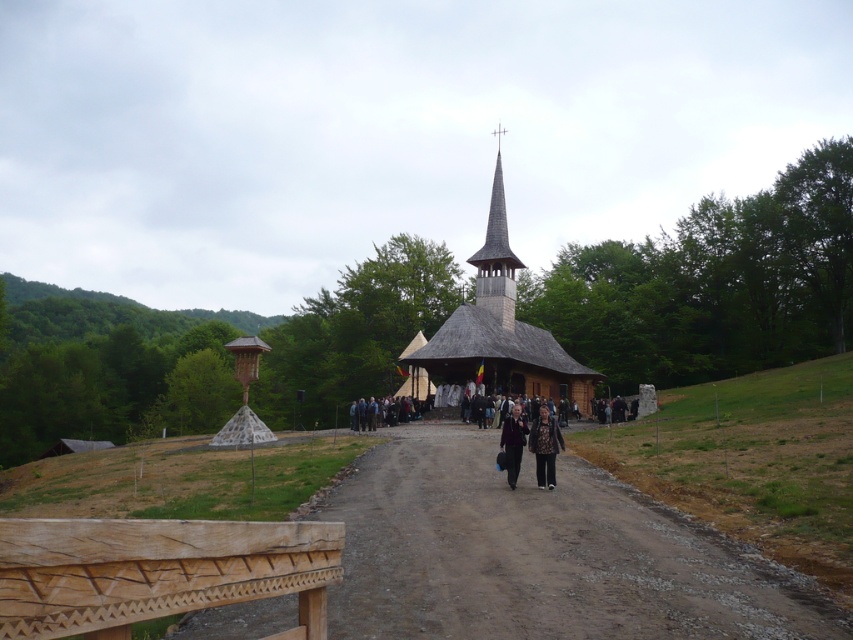
You are standing at the entrance of the church and see the wooden gazebo at left and the dark brown leather jacket at center. Which object is closer to your right side?

The dark brown leather jacket at center is closer to your right side because the wooden gazebo at left is positioned on the left side of it.

You are standing at the entrance of the wooden church and looking towards the wooden gazebo at left and the dark brown leather jacket at center. Which object is positioned lower in the scene?

The wooden gazebo at left is positioned lower than the dark brown leather jacket at center, so the wooden gazebo at left is lower.

You are attending an outdoor event at the church and notice the wooden gazebo at left and the patterned fabric coat at center. Which object is located higher relative to the other?

The wooden gazebo at left is positioned under the patterned fabric coat at center, meaning the patterned fabric coat at center is higher.